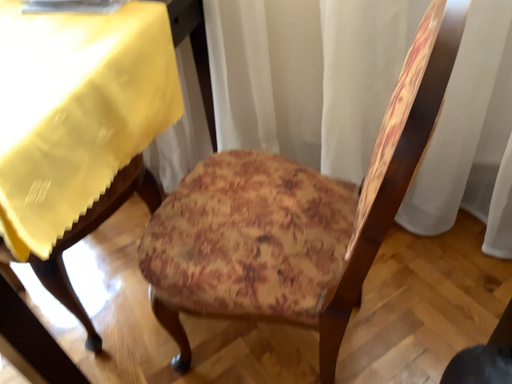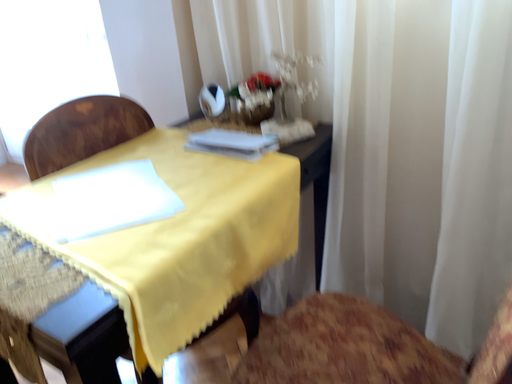
Question: How did the camera likely rotate when shooting the video?

Choices:
 (A) rotated downward
 (B) rotated upward

Answer: (B)